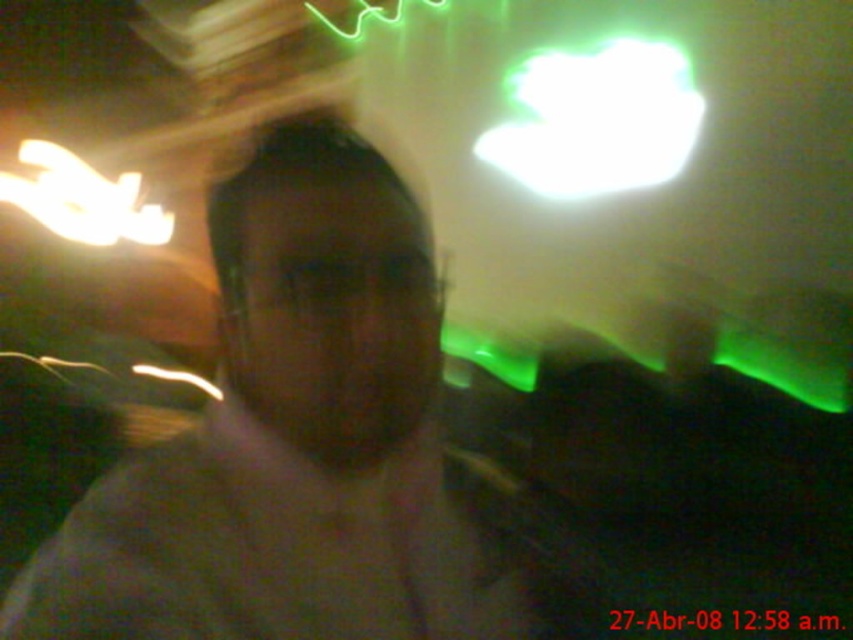
Is the position of matte gray shirt at center less distant than that of dark gray cotton dress shirt at center?

Yes, matte gray shirt at center is in front of dark gray cotton dress shirt at center.

How much distance is there between matte gray shirt at center and dark gray cotton dress shirt at center?

matte gray shirt at center is 1.26 inches away from dark gray cotton dress shirt at center.

This screenshot has height=640, width=853. I want to click on matte gray shirt at center, so click(x=292, y=440).

Identify the location of matte gray shirt at center. The width and height of the screenshot is (853, 640). (x=292, y=440).